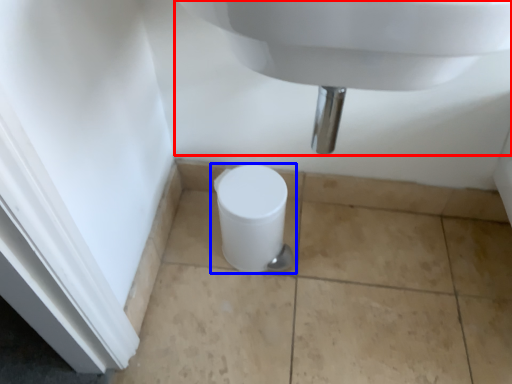
Question: Which object appears farthest to the camera in this image, sink (highlighted by a red box) or toilet (highlighted by a blue box)?

Choices:
 (A) sink
 (B) toilet

Answer: (B)